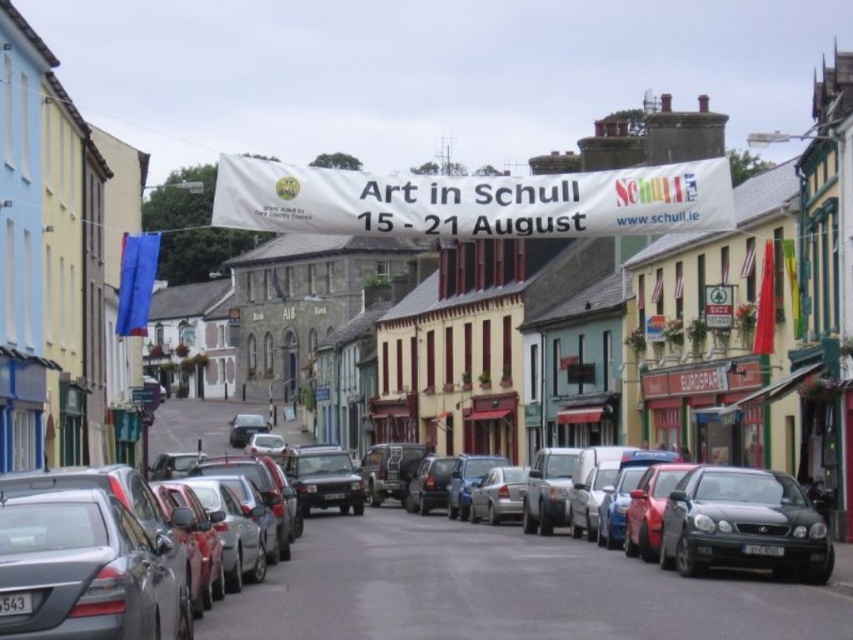
Does point (436, 596) come closer to viewer compared to point (814, 536)?

Yes, point (436, 596) is in front of point (814, 536).

The image size is (853, 640). What do you see at coordinates (502, 589) in the screenshot? I see `shiny black sedan at center` at bounding box center [502, 589].

Who is more forward, [361,620] or [759,557]?

Positioned in front is point [361,620].

The width and height of the screenshot is (853, 640). I want to click on shiny black sedan at center, so click(502, 589).